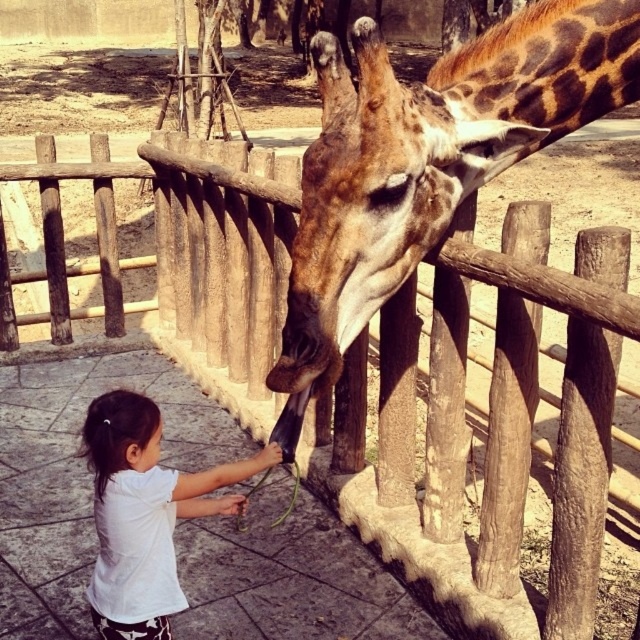
Between point (422, 204) and point (122, 493), which one is positioned behind?

The point (122, 493) is more distant.

Can you confirm if spotted brown giraffe at center is shorter than white cotton shirt at lower left?

In fact, spotted brown giraffe at center may be taller than white cotton shirt at lower left.

Who is more distant from viewer, (609, 90) or (108, 435)?

Point (609, 90)

Find the location of a particular element. spotted brown giraffe at center is located at coordinates (429, 156).